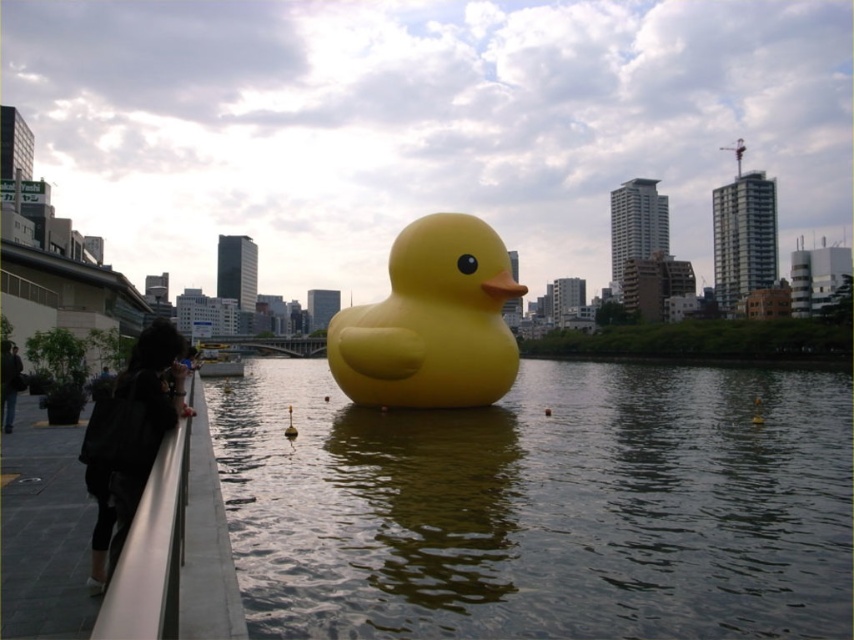
Question: Does yellow rubber duck at center lie in front of black fabric jacket at lower left?

Choices:
 (A) no
 (B) yes

Answer: (A)

Question: Can you confirm if yellow rubber duck at center is thinner than black fabric jacket at lower left?

Choices:
 (A) no
 (B) yes

Answer: (B)

Question: Which of these objects is positioned closest to the smooth water at center?

Choices:
 (A) black fabric jacket at lower left
 (B) yellow rubber duck at center
 (C) dark gray jacket at lower left

Answer: (B)

Question: Which of the following is the closest to the observer?

Choices:
 (A) (6, 339)
 (B) (123, 499)
 (C) (499, 426)

Answer: (B)

Question: Which point appears closest to the camera in this image?

Choices:
 (A) (524, 380)
 (B) (408, 344)

Answer: (B)

Question: Does smooth water at center appear on the left side of black fabric jacket at lower left?

Choices:
 (A) no
 (B) yes

Answer: (A)